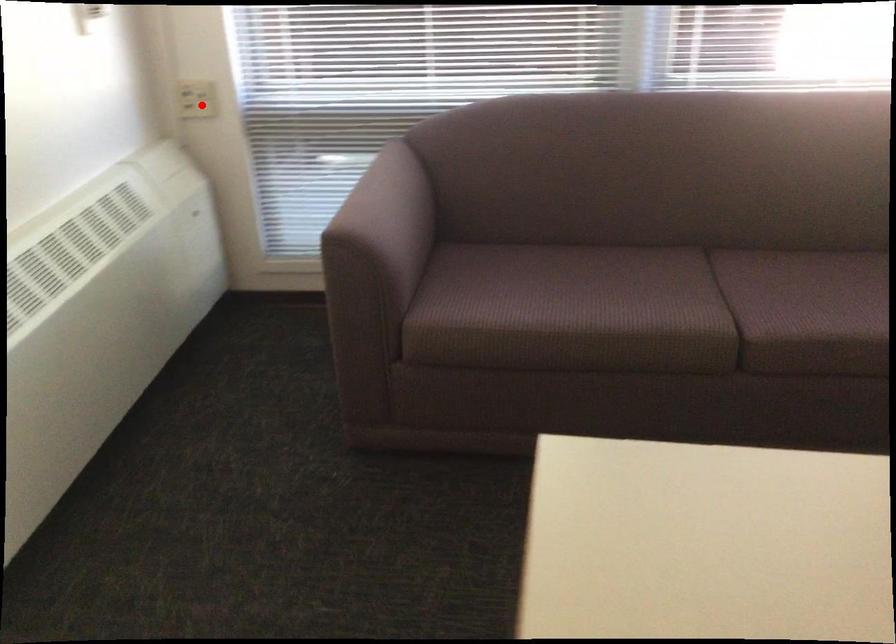
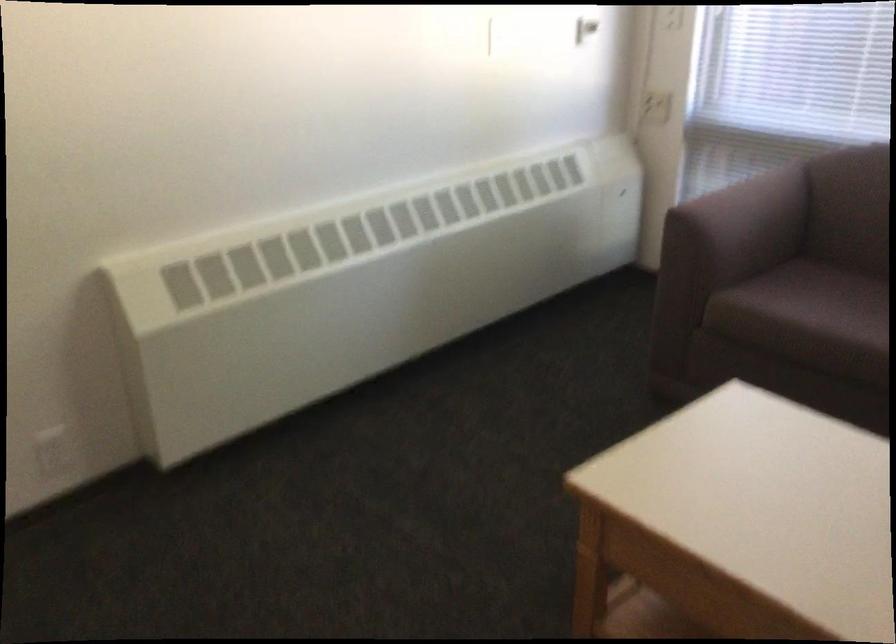
Question: A red point is marked in image1. In image2, is the corresponding 3D point closer to the camera or farther? Reply with the corresponding letter.

Choices:
 (A) The corresponding 3D point is closer.
 (B) The corresponding 3D point is farther.

Answer: (B)